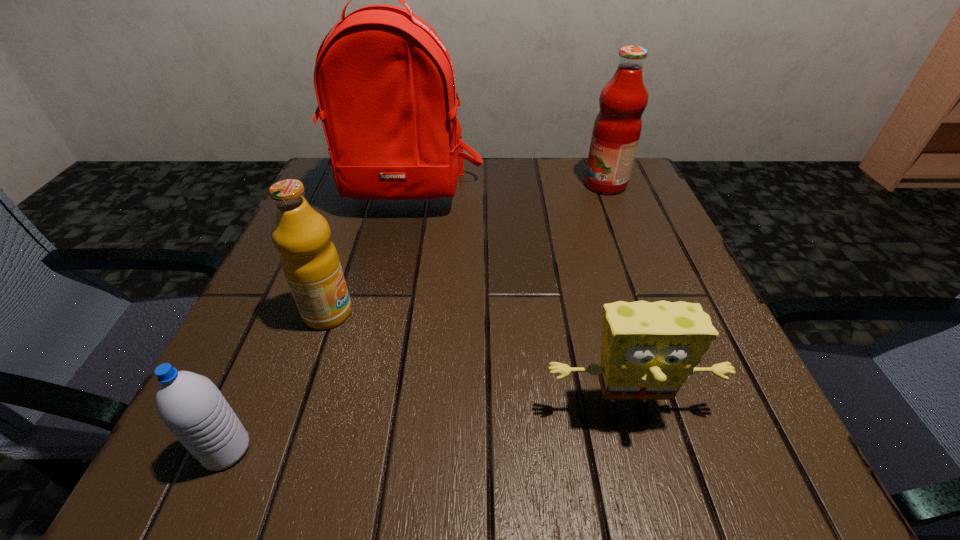
This screenshot has width=960, height=540. Identify the location of free space located 0.060m on the front label of the second tallest object. (559, 185).

Identify the location of vacant space positioned 0.210m on the front label of the shorter fruit juice. (478, 313).

Find the location of `blank area located on the back of the water bottle`. blank area located on the back of the water bottle is located at coordinates (311, 254).

What are the coordinates of `backpack that is at the far edge` in the screenshot? It's located at pyautogui.click(x=385, y=85).

The width and height of the screenshot is (960, 540). Find the location of `fruit juice at the far edge`. fruit juice at the far edge is located at coordinates (617, 128).

You are a GUI agent. You are given a task and a screenshot of the screen. Output one action in this format:
    pyautogui.click(x=<x>, y=<y>)
    Task: Click on the sponge that is at the near edge
    
    Given the screenshot: What is the action you would take?
    pyautogui.click(x=648, y=350)

The width and height of the screenshot is (960, 540). Find the location of `water bottle that is positioned at the near edge`. water bottle that is positioned at the near edge is located at coordinates (190, 405).

In order to click on backpack located in the left edge section of the desktop in this screenshot , I will do `click(385, 85)`.

You are a GUI agent. You are given a task and a screenshot of the screen. Output one action in this format:
    pyautogui.click(x=<x>, y=<y>)
    Task: Click on the fruit juice situated at the left edge
    The height and width of the screenshot is (540, 960).
    Given the screenshot: What is the action you would take?
    pyautogui.click(x=310, y=262)

Image resolution: width=960 pixels, height=540 pixels. Find the location of `water bottle located in the left edge section of the desktop`. water bottle located in the left edge section of the desktop is located at coordinates (190, 405).